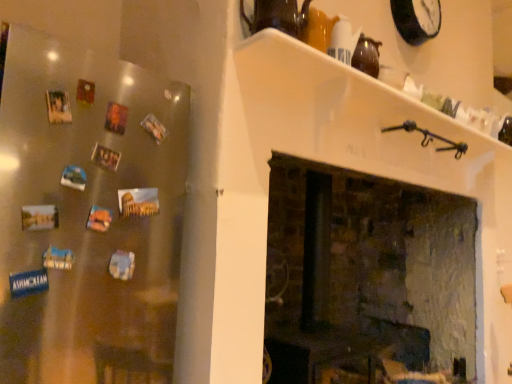
The image size is (512, 384). In order to click on matte brown teapot at upper center in this screenshot , I will do [x=278, y=17].

Measure the distance between black plastic clock at upper right and camera.

They are 1.97 meters apart.

The height and width of the screenshot is (384, 512). Identify the location of matte brown teapot at upper center. (278, 17).

Consider the image. Is rustic brick fireplace at center completely or partially outside of black plastic clock at upper right?

Yes, rustic brick fireplace at center is located beyond the bounds of black plastic clock at upper right.

From the picture: Can you confirm if rustic brick fireplace at center is shorter than black plastic clock at upper right?

No.

From a real-world perspective, which is physically above, rustic brick fireplace at center or black plastic clock at upper right?

black plastic clock at upper right is physically above.

Which point is more distant from viewer, (283, 173) or (417, 11)?

The point (283, 173) is behind.

Is satin silver fridge magnets at left closer to camera compared to rustic brick fireplace at center?

Yes, the depth of satin silver fridge magnets at left is less than that of rustic brick fireplace at center.

From a real-world perspective, is satin silver fridge magnets at left physically located above or below rustic brick fireplace at center?

Clearly, from a real-world perspective, satin silver fridge magnets at left is above rustic brick fireplace at center.

Which is more to the left, satin silver fridge magnets at left or rustic brick fireplace at center?

satin silver fridge magnets at left.

This screenshot has width=512, height=384. Find the location of `fireplace below the satin silver fridge magnets at left (from the image's perspective)`. fireplace below the satin silver fridge magnets at left (from the image's perspective) is located at coordinates (365, 276).

Does black plastic clock at upper right come in front of rustic brick fireplace at center?

No, the depth of black plastic clock at upper right is greater than that of rustic brick fireplace at center.

Where is `fireplace located below the black plastic clock at upper right (from the image's perspective)`? fireplace located below the black plastic clock at upper right (from the image's perspective) is located at coordinates (365, 276).

Between black plastic clock at upper right and rustic brick fireplace at center, which one has less height?

Standing shorter between the two is black plastic clock at upper right.

Does point (426, 5) lie in front of point (290, 266)?

Yes, it is.

Is rustic brick fireplace at center outside of satin silver fridge magnets at left?

That's correct, rustic brick fireplace at center is outside of satin silver fridge magnets at left.

Looking at the image, does rustic brick fireplace at center seem bigger or smaller compared to satin silver fridge magnets at left?

Clearly, rustic brick fireplace at center is larger in size than satin silver fridge magnets at left.

Based on the photo, between rustic brick fireplace at center and satin silver fridge magnets at left, which one has less height?

satin silver fridge magnets at left is shorter.

Is matte brown teapot at upper center in contact with satin silver fridge magnets at left?

matte brown teapot at upper center and satin silver fridge magnets at left are clearly separated.

From the image's perspective, is matte brown teapot at upper center above or below satin silver fridge magnets at left?

Based on their image positions, matte brown teapot at upper center is located above satin silver fridge magnets at left.

From the picture: Is matte brown teapot at upper center looking in the opposite direction of satin silver fridge magnets at left?

No, satin silver fridge magnets at left is not at the back of matte brown teapot at upper center.

Consider the image. How many degrees apart are the facing directions of matte brown teapot at upper center and satin silver fridge magnets at left?

There is a 0.128-degree angle between the facing directions of matte brown teapot at upper center and satin silver fridge magnets at left.

Does black plastic clock at upper right have a lesser width compared to white glossy shelf at upper center?

Indeed, black plastic clock at upper right has a lesser width compared to white glossy shelf at upper center.

Is black plastic clock at upper right oriented towards white glossy shelf at upper center?

No, black plastic clock at upper right is not oriented towards white glossy shelf at upper center.

Does black plastic clock at upper right have a lesser height compared to white glossy shelf at upper center?

In fact, black plastic clock at upper right may be taller than white glossy shelf at upper center.

Is black plastic clock at upper right to the left of white glossy shelf at upper center from the viewer's perspective?

Yes, black plastic clock at upper right is to the left of white glossy shelf at upper center.

Is satin silver fridge magnets at left far from white glossy shelf at upper center?

No.

From the image's perspective, which is below, satin silver fridge magnets at left or white glossy shelf at upper center?

satin silver fridge magnets at left.

Considering the sizes of satin silver fridge magnets at left and white glossy shelf at upper center in the image, is satin silver fridge magnets at left bigger or smaller than white glossy shelf at upper center?

In the image, satin silver fridge magnets at left appears to be larger than white glossy shelf at upper center.

The image size is (512, 384). Find the location of `fireplace in front of the black plastic clock at upper right`. fireplace in front of the black plastic clock at upper right is located at coordinates (365, 276).

You are a GUI agent. You are given a task and a screenshot of the screen. Output one action in this format:
    pyautogui.click(x=<x>, y=<y>)
    Task: Click on the fireplace below the satin silver fridge magnets at left (from the image's perspective)
    
    Given the screenshot: What is the action you would take?
    pyautogui.click(x=365, y=276)

From the picture: Looking at the image, which one is located further to rustic brick fireplace at center, black plastic clock at upper right or satin silver fridge magnets at left?

The object further to rustic brick fireplace at center is satin silver fridge magnets at left.

Which object lies further to the anchor point black plastic clock at upper right, white glossy shelf at upper center or matte brown teapot at upper center?

matte brown teapot at upper center lies further to black plastic clock at upper right than the other object.

When comparing their distances from white glossy shelf at upper center, does black plastic clock at upper right or rustic brick fireplace at center seem further?

rustic brick fireplace at center lies further to white glossy shelf at upper center than the other object.

From the picture: Estimate the real-world distances between objects in this image. Which object is further from satin silver fridge magnets at left, white glossy shelf at upper center or matte brown teapot at upper center?

Answer: matte brown teapot at upper center is positioned further to the anchor satin silver fridge magnets at left.

Which object lies further to the anchor point rustic brick fireplace at center, black plastic clock at upper right or white glossy shelf at upper center?

black plastic clock at upper right is positioned further to the anchor rustic brick fireplace at center.

Considering their positions, is matte brown teapot at upper center positioned closer to black plastic clock at upper right than satin silver fridge magnets at left?

matte brown teapot at upper center is closer to black plastic clock at upper right.

Based on their spatial positions, is matte brown teapot at upper center or black plastic clock at upper right closer to white glossy shelf at upper center?

matte brown teapot at upper center lies closer to white glossy shelf at upper center than the other object.

Estimate the real-world distances between objects in this image. Which object is further from matte brown teapot at upper center, satin silver fridge magnets at left or rustic brick fireplace at center?

rustic brick fireplace at center is positioned further to the anchor matte brown teapot at upper center.

Where is `tea pot located between satin silver fridge magnets at left and white glossy shelf at upper center in the left-right direction`? This screenshot has width=512, height=384. tea pot located between satin silver fridge magnets at left and white glossy shelf at upper center in the left-right direction is located at coordinates (278, 17).

This screenshot has height=384, width=512. I want to click on fridge between matte brown teapot at upper center and rustic brick fireplace at center from top to bottom, so (x=88, y=215).

The image size is (512, 384). I want to click on fireplace between satin silver fridge magnets at left and white glossy shelf at upper center in the horizontal direction, so (x=365, y=276).

What are the coordinates of `clock located between satin silver fridge magnets at left and white glossy shelf at upper center in the left-right direction` in the screenshot? It's located at coord(416,19).